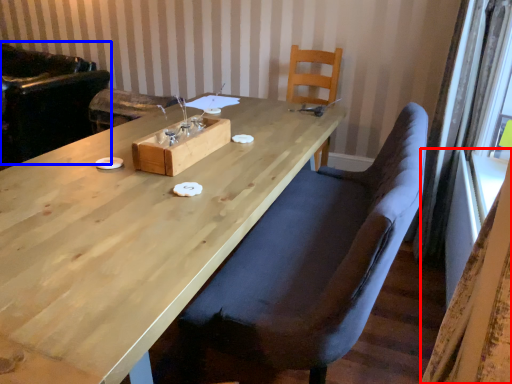
Question: Which object is closer to the camera taking this photo, curtain (highlighted by a red box) or armchair (highlighted by a blue box)?

Choices:
 (A) curtain
 (B) armchair

Answer: (A)